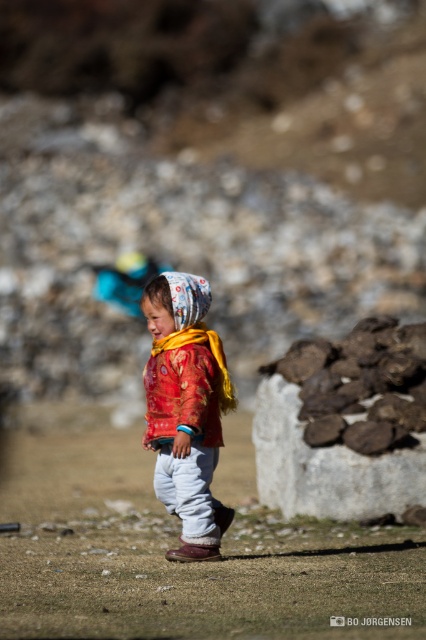
Looking at this image, the child is wearing a matte red jacket at center and a printed fabric headscarf at center. Which clothing item is bigger in size?

The matte red jacket at center is larger in size compared to the printed fabric headscarf at center.

You are a fashion designer observing the child in the scene. You want to create a new outfit that maintains the same color scheme but swaps the positions of the matte red jacket at center and the printed fabric headscarf at center. Is this possible without overlapping them?

The matte red jacket at center is positioned on the right side of the printed fabric headscarf at center. Since they are both worn by the child, swapping their positions would require moving the jacket to the left side of the headscarf. However, clothing items cannot occupy the same space simultaneously, so overlapping might occur. Therefore, it is not possible to swap their positions without overlapping.